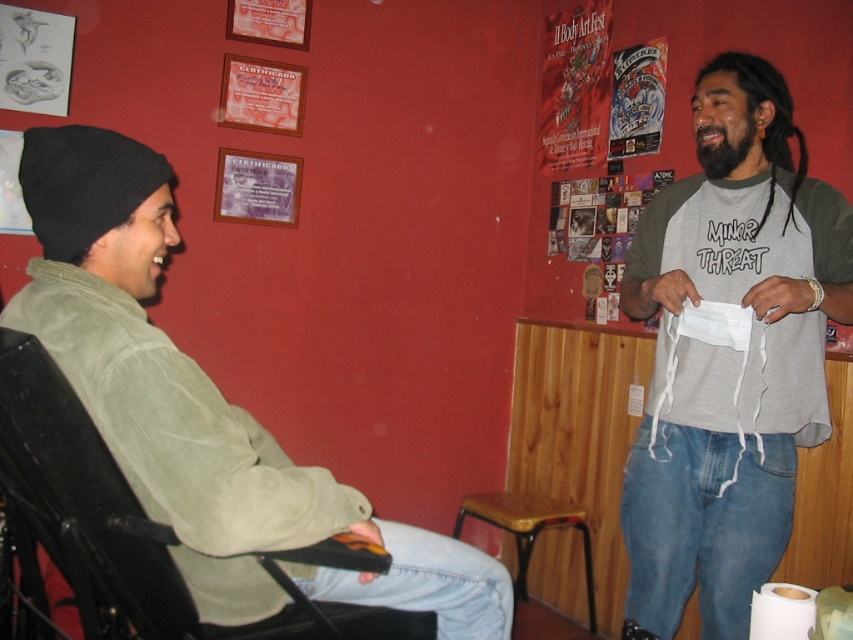
Question: Considering the real-world distances, which object is closest to the green corduroy jacket at left?

Choices:
 (A) leather-like stool at center
 (B) gray cotton t-shirt at center

Answer: (B)

Question: Which object is closer to the camera taking this photo?

Choices:
 (A) green corduroy jacket at left
 (B) leather-like stool at center

Answer: (A)

Question: Which object appears farthest from the camera in this image?

Choices:
 (A) gray cotton t-shirt at center
 (B) leather-like stool at center

Answer: (B)

Question: Does gray cotton t-shirt at center have a lesser width compared to leather-like stool at center?

Choices:
 (A) no
 (B) yes

Answer: (B)

Question: Is gray cotton t-shirt at center positioned before leather-like stool at center?

Choices:
 (A) yes
 (B) no

Answer: (A)

Question: Can you confirm if green corduroy jacket at left is wider than leather-like stool at center?

Choices:
 (A) yes
 (B) no

Answer: (A)